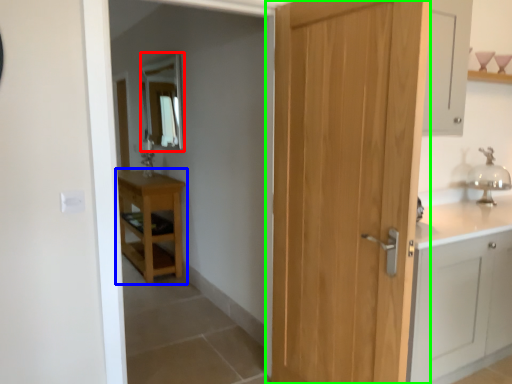
Question: Considering the real-world distances, which object is closest to mirror (highlighted by a red box)? table (highlighted by a blue box) or door (highlighted by a green box).

Choices:
 (A) table
 (B) door

Answer: (A)